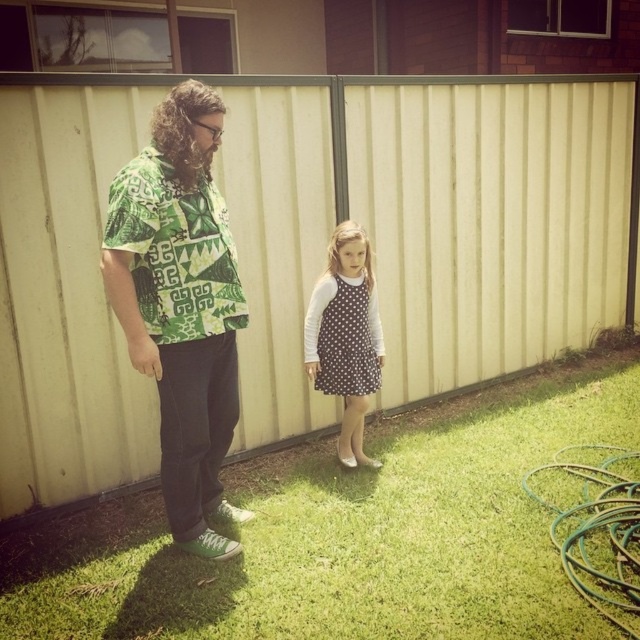
You are a photographer trying to capture a photo of the brown dotted fabric dress at center without the green rubber hose at lower right appearing in the foreground. Based on their positions, is this possible?

The green rubber hose at lower right is positioned under the brown dotted fabric dress at center, so adjusting the camera angle to focus on the dress from above or the side could avoid the hose appearing in the foreground.

You are a photographer trying to capture a clear photo of the green printed shirt at center and the green rubber hose at lower right. Which object should you focus on first if you want to ensure both are in focus without adjusting the camera settings?

The green printed shirt at center is much taller than the green rubber hose at lower right. Since the green printed shirt at center is taller, it is farther away from the camera. To ensure both are in focus, you should focus on the farther object first, which is the green printed shirt at center.